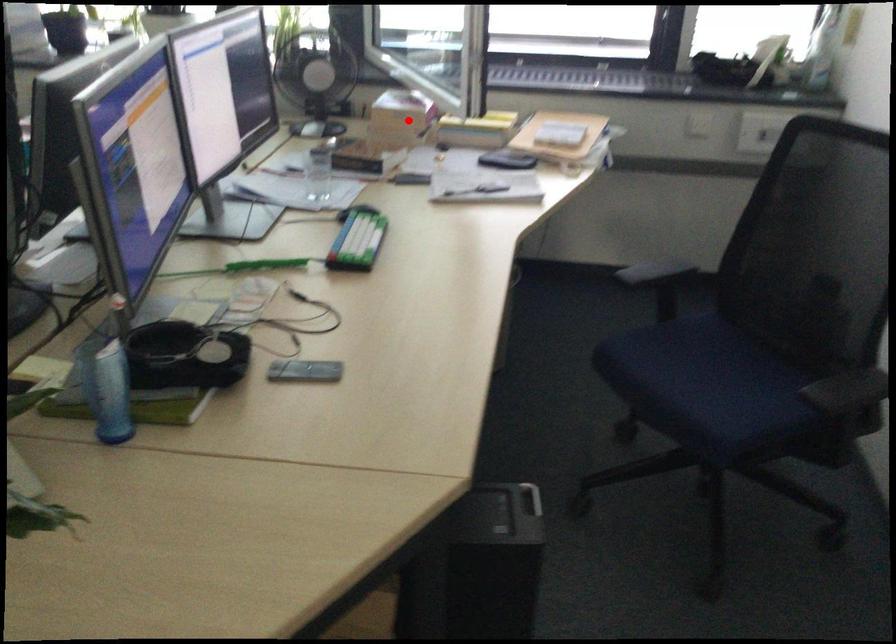
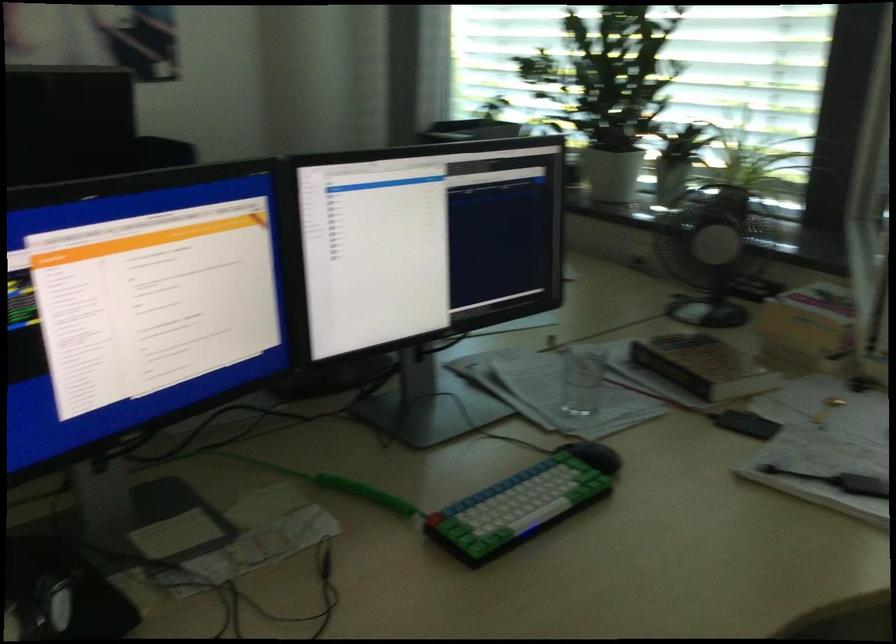
In the second image, find the point that corresponds to the highlighted location in the first image.

(810, 326)